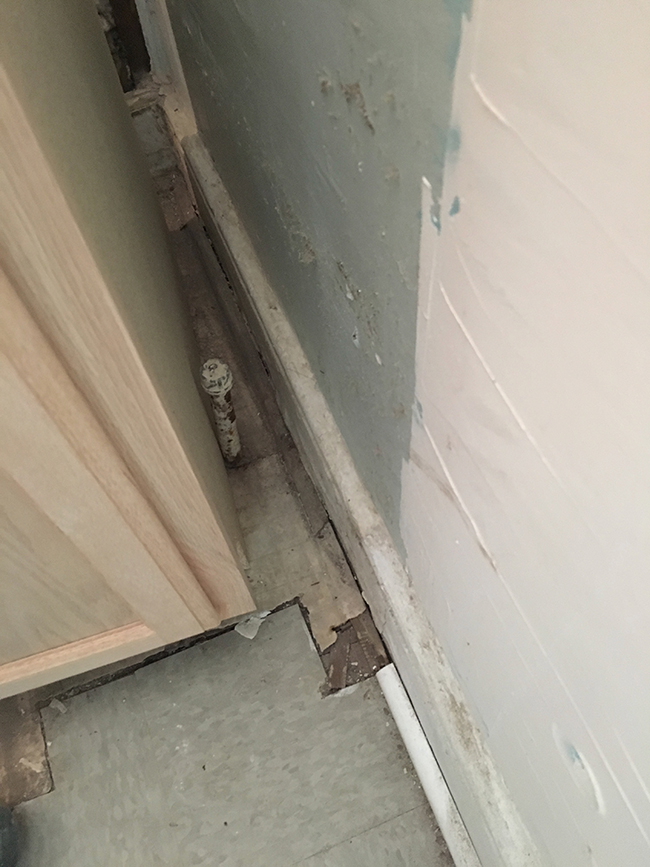
The width and height of the screenshot is (650, 867). I want to click on right front edge of cabinet, so click(x=166, y=486).